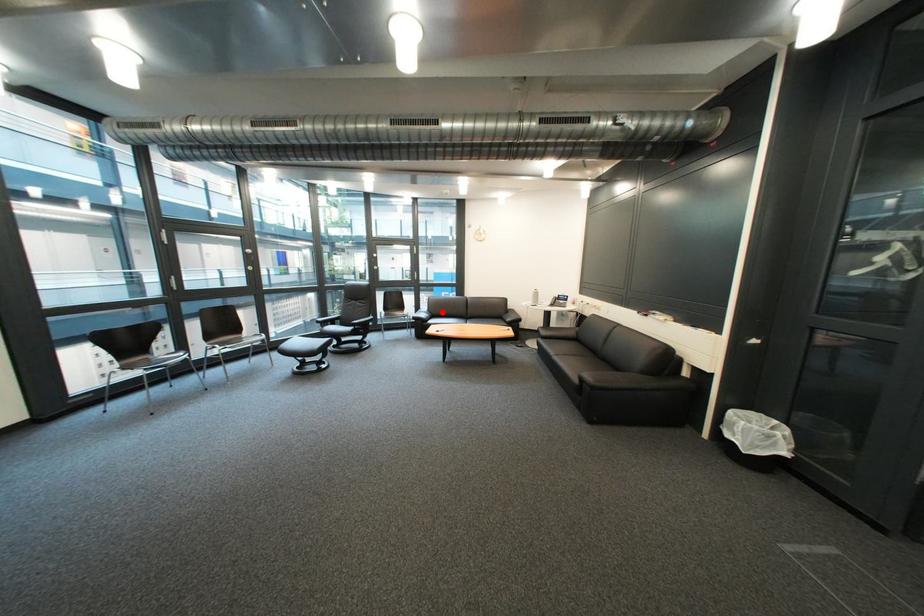
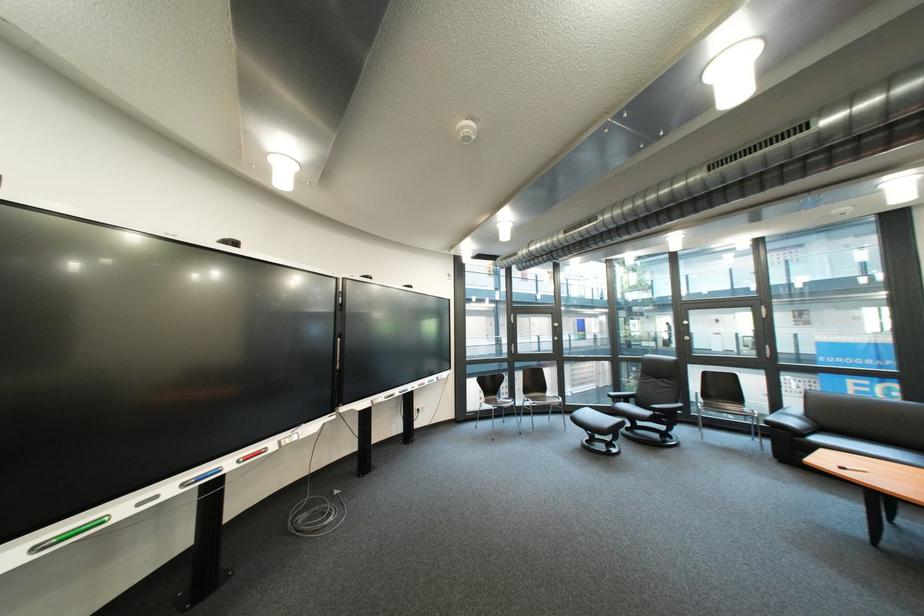
Question: I am providing you with two images of the same scene from different viewpoints. A red point is shown in image1. For the corresponding object point in image2, is it positioned nearer or farther from the camera?

Choices:
 (A) Nearer
 (B) Farther

Answer: (A)